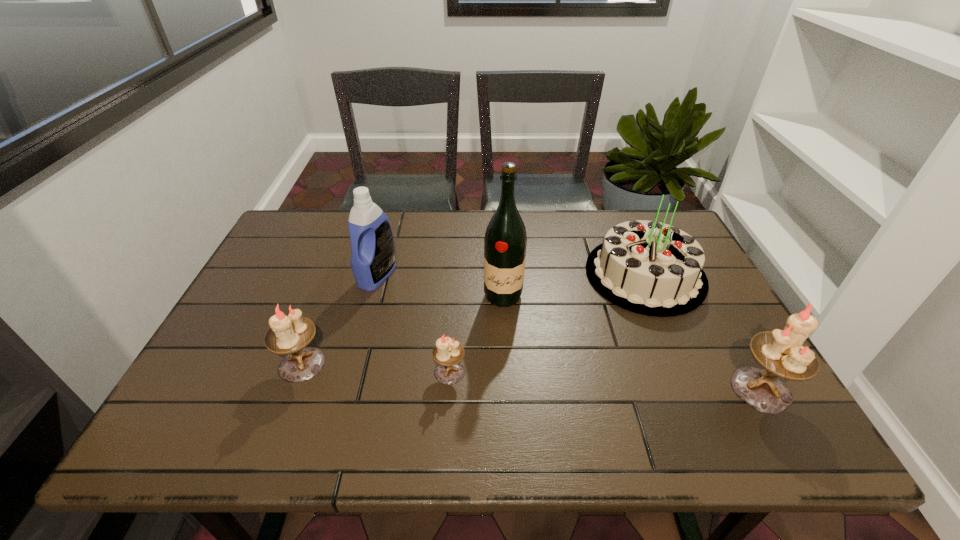
Locate an element on the screen. free spot that satisfies the following two spatial constraints: 1. on the front side of the detergent; 2. on the right side of the rightmost candle holder is located at coordinates (347, 389).

Locate an element on the screen. free point that satisfies the following two spatial constraints: 1. on the front-facing side of the rightmost candle holder; 2. on the right side of the tallest object is located at coordinates (509, 389).